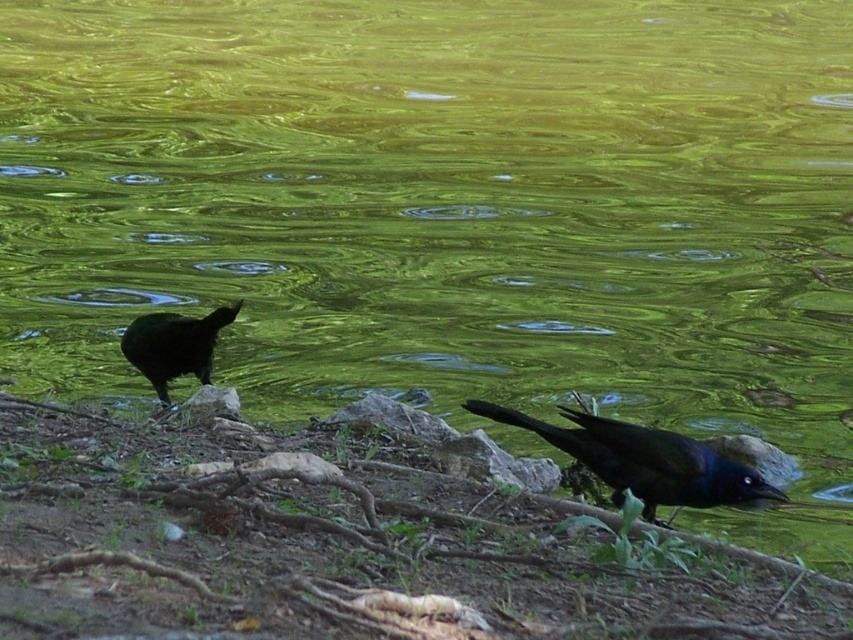
Question: Is shiny black bird at lower left positioned behind gray rough stone at center?

Choices:
 (A) no
 (B) yes

Answer: (B)

Question: Estimate the real-world distances between objects in this image. Which object is closer to the shiny black bird at lower right?

Choices:
 (A) smooth gray rock at center
 (B) shiny black bird at lower left
 (C) gray rough stone at center

Answer: (A)

Question: Is shiny black bird at lower left bigger than gray rough stone at center?

Choices:
 (A) yes
 (B) no

Answer: (A)

Question: Which point is farther to the camera?

Choices:
 (A) (224, 413)
 (B) (180, 362)
 (C) (440, 436)
 (D) (723, 477)

Answer: (B)

Question: Which point is closer to the camera?

Choices:
 (A) shiny black bird at lower right
 (B) gray rough stone at center

Answer: (A)

Question: Does shiny black bird at lower right have a larger size compared to shiny black bird at lower left?

Choices:
 (A) yes
 (B) no

Answer: (A)